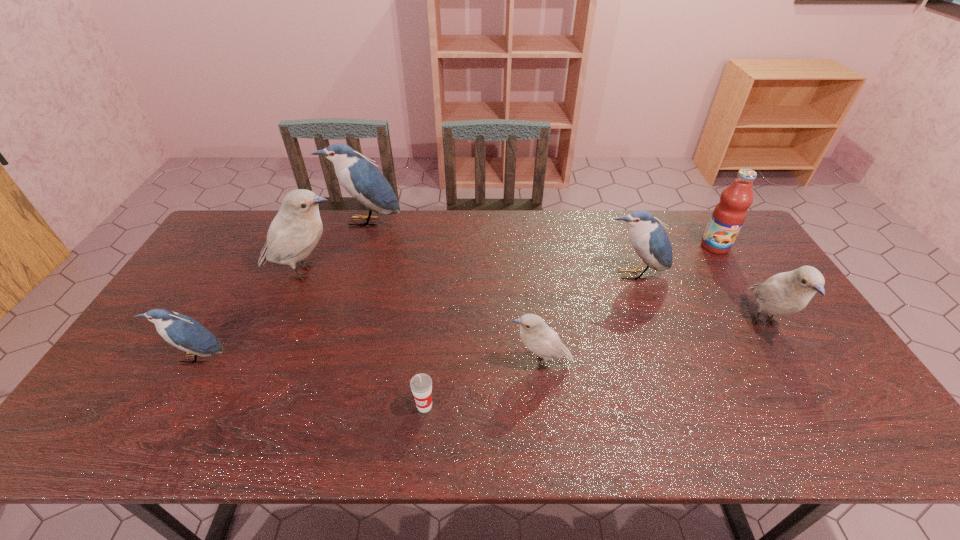
The image size is (960, 540). Identify the location of vacant space that is in between the second white bird from left to right and the leftmost white bird. click(x=422, y=318).

Locate an element on the screen. This screenshot has height=540, width=960. free spot between the second nearest blue bird and the nearest white bird is located at coordinates (587, 319).

Locate an element on the screen. The width and height of the screenshot is (960, 540). vacant point located between the leftmost white bird and the third object from right to left is located at coordinates (468, 273).

Find the location of a particular element. The height and width of the screenshot is (540, 960). free space between the rightmost white bird and the farthest blue bird is located at coordinates (564, 272).

This screenshot has width=960, height=540. I want to click on empty space between the nearest object and the rightmost bird, so click(x=594, y=364).

Locate which object ranks third in proximity to the red cup. Please provide its 2D coordinates. Your answer should be formatted as a tuple, i.e. [(x, y)], where the tuple contains the x and y coordinates of a point satisfying the conditions above.

[(181, 331)]

Locate which object ranks third in proximity to the farthest bird. Please provide its 2D coordinates. Your answer should be formatted as a tuple, i.e. [(x, y)], where the tuple contains the x and y coordinates of a point satisfying the conditions above.

[(536, 335)]

Locate an element on the screen. The width and height of the screenshot is (960, 540). bird that is the closest one to the second farthest object is located at coordinates (649, 239).

The width and height of the screenshot is (960, 540). Identify the location of the closest bird to the leftmost white bird. (359, 176).

Find the location of a particular element. The width and height of the screenshot is (960, 540). blue bird that is the second nearest to the fruit juice is located at coordinates (359, 176).